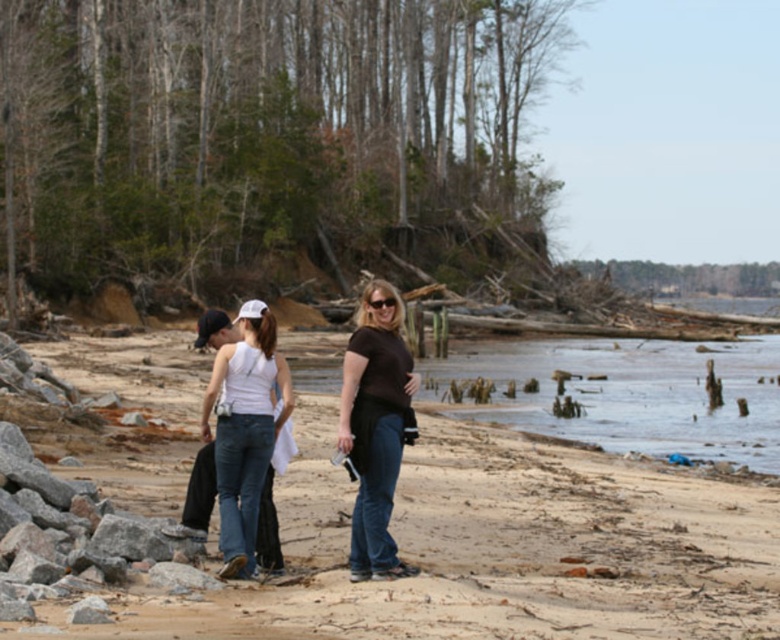
Which of these two, brown muddy water at lower right or white denim jeans at center, stands shorter?

Standing shorter between the two is white denim jeans at center.

You are a GUI agent. You are given a task and a screenshot of the screen. Output one action in this format:
    pyautogui.click(x=<x>, y=<y>)
    Task: Click on the brown muddy water at lower right
    The image size is (780, 640).
    Given the screenshot: What is the action you would take?
    [633, 394]

You are a GUI agent. You are given a task and a screenshot of the screen. Output one action in this format:
    pyautogui.click(x=<x>, y=<y>)
    Task: Click on the brown muddy water at lower right
    This screenshot has height=640, width=780.
    Given the screenshot: What is the action you would take?
    pyautogui.click(x=633, y=394)

Is matte brown shirt at center shorter than white denim jeans at center?

Correct, matte brown shirt at center is not as tall as white denim jeans at center.

Between matte brown shirt at center and white denim jeans at center, which one appears on the right side from the viewer's perspective?

From the viewer's perspective, matte brown shirt at center appears more on the right side.

Is point (385, 291) positioned after point (238, 374)?

That is False.

This screenshot has width=780, height=640. What are the coordinates of `matte brown shirt at center` in the screenshot? It's located at (374, 428).

Is the position of brown muddy water at lower right less distant than that of matte brown shirt at center?

No, it is not.

Does point (619, 442) lie in front of point (394, 468)?

That is False.

Identify the location of brown muddy water at lower right. (633, 394).